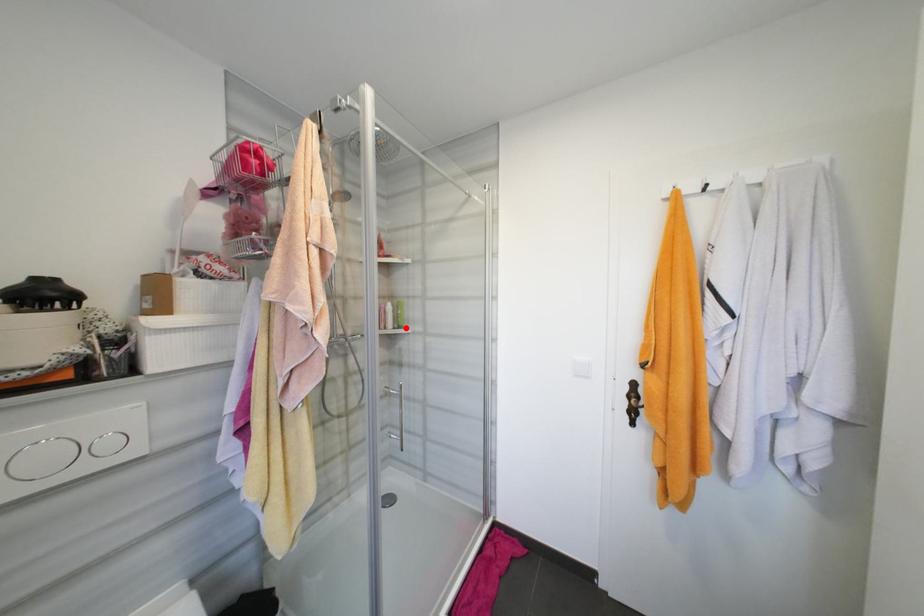
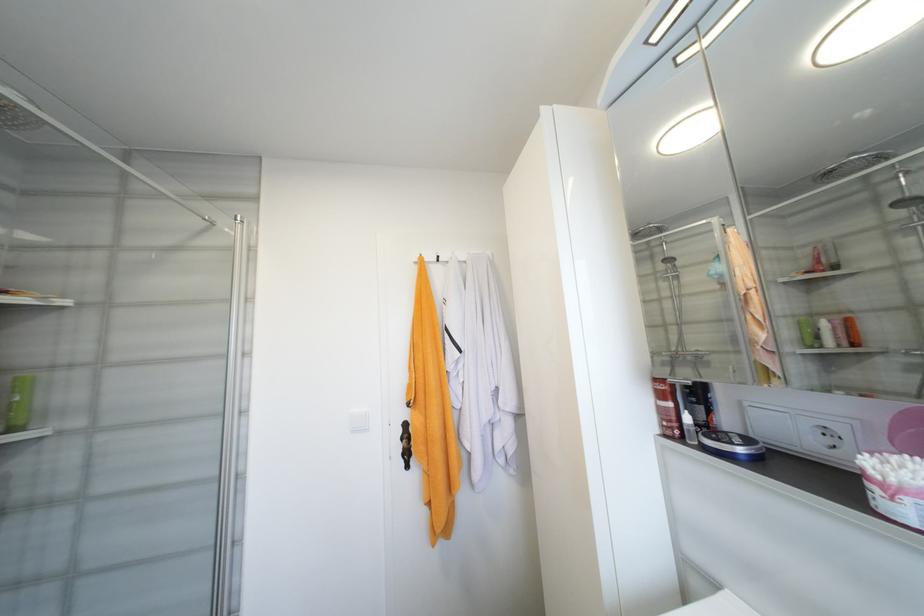
Question: I am providing you with two images of the same scene from different viewpoints. Image1 has a red point marked. In image2, the corresponding 3D location appears at what relative position? Reply with the corresponding letter.

Choices:
 (A) Closer
 (B) Farther

Answer: (A)